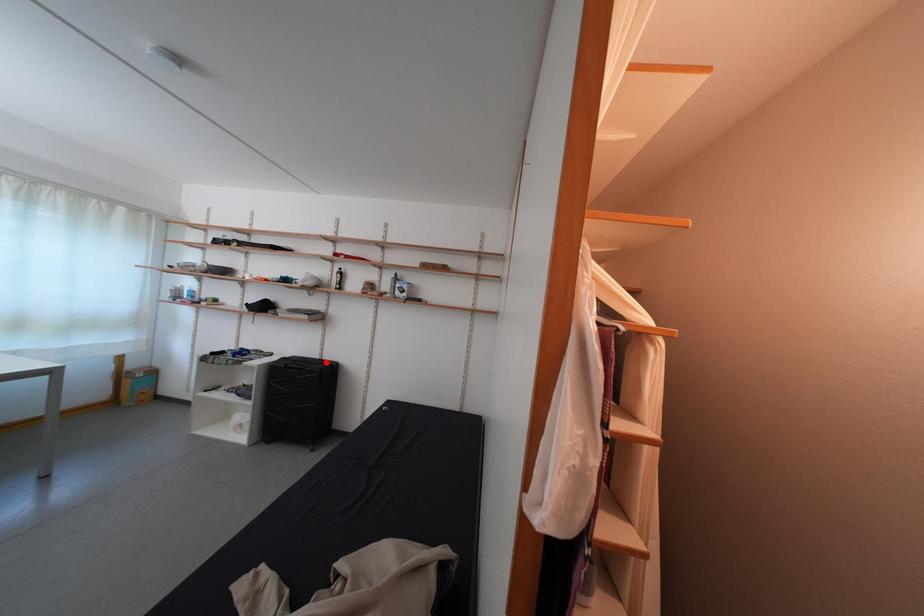
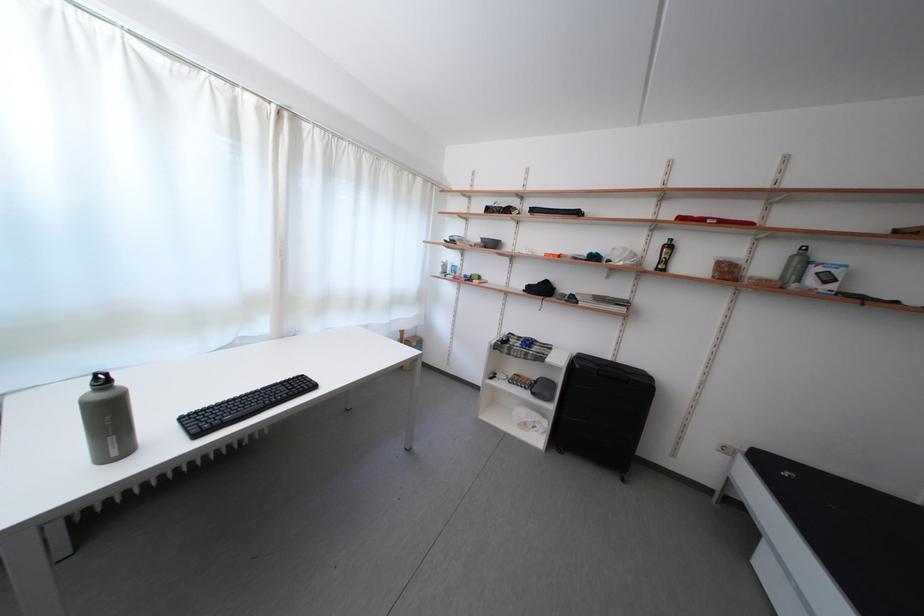
Question: I am providing you with two images of the same scene from different viewpoints. Given a red point in image1, look at the same physical point in image2. Is it:

Choices:
 (A) Closer to the viewpoint
 (B) Farther from the viewpoint

Answer: (A)